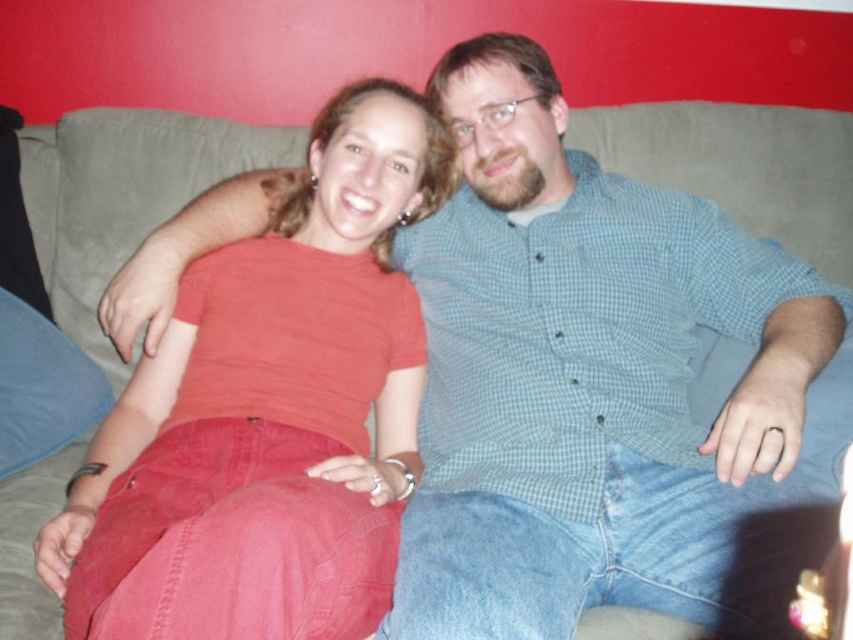
Which of these two, green checkered shirt at center or matte red shirt at center, stands shorter?

matte red shirt at center is shorter.

Between green checkered shirt at center and matte red shirt at center, which one has more height?

With more height is green checkered shirt at center.

Where is `green checkered shirt at center`? This screenshot has width=853, height=640. green checkered shirt at center is located at coordinates (595, 387).